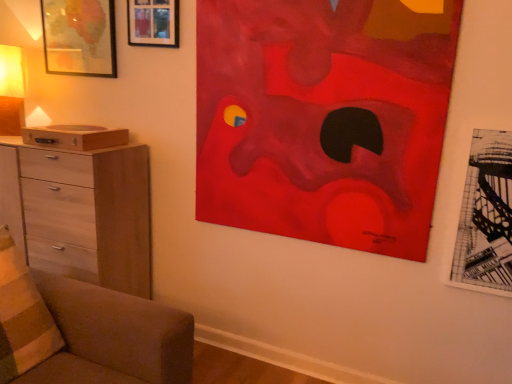
What do you see at coordinates (81, 212) in the screenshot? The height and width of the screenshot is (384, 512). I see `light wood chest of drawers at left` at bounding box center [81, 212].

What do you see at coordinates (486, 217) in the screenshot? The width and height of the screenshot is (512, 384). I see `black paper picture frame at right, the third picture frame when ordered from left to right` at bounding box center [486, 217].

What is the approximate height of brown fabric couch at lower left?

It is 59.19 centimeters.

The width and height of the screenshot is (512, 384). Describe the element at coordinates (85, 331) in the screenshot. I see `brown fabric couch at lower left` at that location.

The width and height of the screenshot is (512, 384). I want to click on matte wooden picture frame at upper left, which is the 1th picture frame in left-to-right order, so click(x=79, y=37).

Considering the relative positions of brown fabric couch at lower left and striped fabric pillow at lower left in the image provided, is brown fabric couch at lower left to the right of striped fabric pillow at lower left from the viewer's perspective?

Indeed, brown fabric couch at lower left is positioned on the right side of striped fabric pillow at lower left.

Who is smaller, brown fabric couch at lower left or striped fabric pillow at lower left?

striped fabric pillow at lower left is smaller.

From the image's perspective, does brown fabric couch at lower left appear lower than striped fabric pillow at lower left?

Yes, from the image's perspective, brown fabric couch at lower left is below striped fabric pillow at lower left.

The height and width of the screenshot is (384, 512). In order to click on furniture on the right of striped fabric pillow at lower left in this screenshot , I will do `click(85, 331)`.

Is black paper picture frame at right, arranged as the 1th picture frame when ordered from the bottom, further to camera compared to brown fabric couch at lower left?

Yes, black paper picture frame at right, arranged as the 1th picture frame when ordered from the bottom, is behind brown fabric couch at lower left.

Which of these two, black paper picture frame at right, arranged as the third picture frame when viewed from the back, or brown fabric couch at lower left, is thinner?

black paper picture frame at right, arranged as the third picture frame when viewed from the back.

Locate an element on the screen. The height and width of the screenshot is (384, 512). furniture in front of the black paper picture frame at right, the first picture frame in the front-to-back sequence is located at coordinates (85, 331).

Which is farther, (509, 215) or (46, 301)?

The point (46, 301) is more distant.

Is matte yellow fabric at left to the right of black paper picture frame at right, arranged as the third picture frame when viewed from the back, from the viewer's perspective?

In fact, matte yellow fabric at left is to the left of black paper picture frame at right, arranged as the third picture frame when viewed from the back.

Would you say matte yellow fabric at left is outside black paper picture frame at right, which appears as the first picture frame when viewed from the right?

Absolutely, matte yellow fabric at left is external to black paper picture frame at right, which appears as the first picture frame when viewed from the right.

Is black paper picture frame at right, which appears as the first picture frame when viewed from the right, at the back of matte yellow fabric at left?

No, black paper picture frame at right, which appears as the first picture frame when viewed from the right, is not at the back of matte yellow fabric at left.

How different are the orientations of matte wooden picture frame at upper left, which is counted as the first picture frame, starting from the back, and striped fabric pillow at lower left in degrees?

They differ by 76.5 degrees in their facing directions.

Which is behind, point (91, 10) or point (2, 288)?

The point (91, 10) is more distant.

Measure the distance between matte wooden picture frame at upper left, which is the second picture frame from top to bottom, and striped fabric pillow at lower left.

1.36 meters.

From a real-world perspective, is matte wooden picture frame at upper left, which is counted as the first picture frame, starting from the back, positioned over striped fabric pillow at lower left based on gravity?

Yes, from a real-world perspective, matte wooden picture frame at upper left, which is counted as the first picture frame, starting from the back, is over striped fabric pillow at lower left

Considering the sizes of objects matte wooden picture frame at upper left, marked as the 3th picture frame in a front-to-back arrangement, and wooden picture frame at upper left, marked as the 2th picture frame in a left-to-right arrangement, in the image provided, who is bigger, matte wooden picture frame at upper left, marked as the 3th picture frame in a front-to-back arrangement, or wooden picture frame at upper left, marked as the 2th picture frame in a left-to-right arrangement,?

With larger size is matte wooden picture frame at upper left, marked as the 3th picture frame in a front-to-back arrangement.

Is matte wooden picture frame at upper left, marked as the 3th picture frame in a front-to-back arrangement, in contact with wooden picture frame at upper left, the first picture frame when ordered from top to bottom?

No, matte wooden picture frame at upper left, marked as the 3th picture frame in a front-to-back arrangement, is not touching wooden picture frame at upper left, the first picture frame when ordered from top to bottom.

Looking at this image, is matte wooden picture frame at upper left, which is counted as the first picture frame, starting from the back, aimed at wooden picture frame at upper left, the 3th picture frame positioned from the bottom?

No, matte wooden picture frame at upper left, which is counted as the first picture frame, starting from the back, is not turned towards wooden picture frame at upper left, the 3th picture frame positioned from the bottom.

From the image's perspective, is matte wooden picture frame at upper left, positioned as the 2th picture frame in bottom-to-top order, over wooden picture frame at upper left, placed as the 2th picture frame when sorted from front to back?

Incorrect, from the image's perspective, matte wooden picture frame at upper left, positioned as the 2th picture frame in bottom-to-top order, is lower than wooden picture frame at upper left, placed as the 2th picture frame when sorted from front to back.

Is black paper picture frame at right, arranged as the third picture frame when viewed from the back, turned away from striped fabric pillow at lower left?

No.

From the image's perspective, is black paper picture frame at right, arranged as the 1th picture frame when ordered from the bottom, above striped fabric pillow at lower left?

Yes, from the image's perspective, black paper picture frame at right, arranged as the 1th picture frame when ordered from the bottom, is above striped fabric pillow at lower left.

Is black paper picture frame at right, arranged as the 1th picture frame when ordered from the bottom, positioned beyond the bounds of striped fabric pillow at lower left?

Yes.

From the image's perspective, does striped fabric pillow at lower left appear higher than matte red abstract painting at upper right?

Incorrect, from the image's perspective, striped fabric pillow at lower left is lower than matte red abstract painting at upper right.

Considering the relative sizes of striped fabric pillow at lower left and matte red abstract painting at upper right in the image provided, is striped fabric pillow at lower left bigger than matte red abstract painting at upper right?

No.

Does striped fabric pillow at lower left turn towards matte red abstract painting at upper right?

No, striped fabric pillow at lower left is not aimed at matte red abstract painting at upper right.

This screenshot has width=512, height=384. In order to click on furniture lying in front of the striped fabric pillow at lower left in this screenshot , I will do `click(85, 331)`.

The image size is (512, 384). In order to click on the 1st picture frame behind the brown fabric couch at lower left in this screenshot , I will do `click(486, 217)`.

From the image, which object appears to be nearer to matte wooden picture frame at upper left, the third picture frame in the right-to-left sequence, brown fabric couch at lower left or wooden picture frame at upper left, which is the 2th picture frame in back-to-front order?

wooden picture frame at upper left, which is the 2th picture frame in back-to-front order, is positioned closer to the anchor matte wooden picture frame at upper left, the third picture frame in the right-to-left sequence.

Based on their spatial positions, is matte red abstract painting at upper right or striped fabric pillow at lower left closer to brown fabric couch at lower left?

The object closer to brown fabric couch at lower left is striped fabric pillow at lower left.

When comparing their distances from brown fabric couch at lower left, does striped fabric pillow at lower left or matte red abstract painting at upper right seem closer?

Among the two, striped fabric pillow at lower left is located nearer to brown fabric couch at lower left.

Looking at the image, which one is located further to brown fabric couch at lower left, matte wooden picture frame at upper left, which is the second picture frame from top to bottom, or matte yellow fabric at left?

matte wooden picture frame at upper left, which is the second picture frame from top to bottom, is further to brown fabric couch at lower left.

Looking at the image, which one is located further to matte yellow fabric at left, brown fabric couch at lower left or light wood chest of drawers at left?

Based on the image, brown fabric couch at lower left appears to be further to matte yellow fabric at left.

Which object lies further to the anchor point wooden picture frame at upper left, the first picture frame when ordered from top to bottom, matte red abstract painting at upper right or black paper picture frame at right, arranged as the third picture frame when viewed from the back?

black paper picture frame at right, arranged as the third picture frame when viewed from the back, is further to wooden picture frame at upper left, the first picture frame when ordered from top to bottom.

Based on their spatial positions, is wooden picture frame at upper left, positioned as the 2th picture frame in right-to-left order, or striped fabric pillow at lower left further from matte red abstract painting at upper right?

Among the two, striped fabric pillow at lower left is located further to matte red abstract painting at upper right.

Looking at the image, which one is located closer to striped fabric pillow at lower left, matte red abstract painting at upper right or matte yellow fabric at left?

matte yellow fabric at left.

Locate an element on the screen. pillow between light wood chest of drawers at left and black paper picture frame at right, which appears as the first picture frame when viewed from the right is located at coordinates (22, 316).

This screenshot has width=512, height=384. In order to click on pillow between matte yellow fabric at left and black paper picture frame at right, placed as the third picture frame when sorted from top to bottom, in the horizontal direction in this screenshot , I will do `click(22, 316)`.

Where is `art situated between brown fabric couch at lower left and black paper picture frame at right, the third picture frame when ordered from left to right, from left to right`? art situated between brown fabric couch at lower left and black paper picture frame at right, the third picture frame when ordered from left to right, from left to right is located at coordinates (323, 119).

What are the coordinates of `art between wooden picture frame at upper left, positioned as the 2th picture frame in right-to-left order, and brown fabric couch at lower left from top to bottom` in the screenshot? It's located at (323, 119).